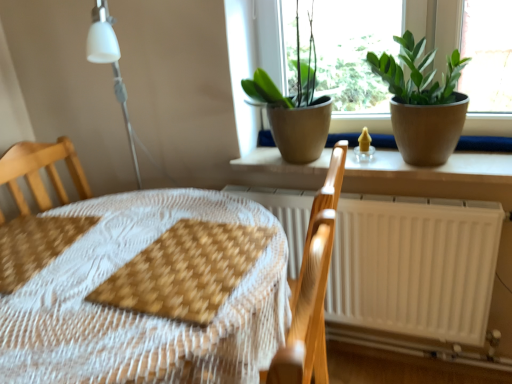
I want to click on vacant space that is to the left of brown woven placemat at center, which is the first sheet in right-to-left order, so click(x=82, y=275).